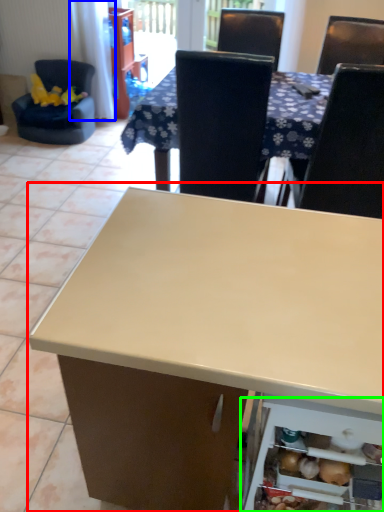
Question: Based on their relative distances, which object is farther from table (highlighted by a red box)? Choose from curtain (highlighted by a blue box) and shelf (highlighted by a green box).

Choices:
 (A) curtain
 (B) shelf

Answer: (A)